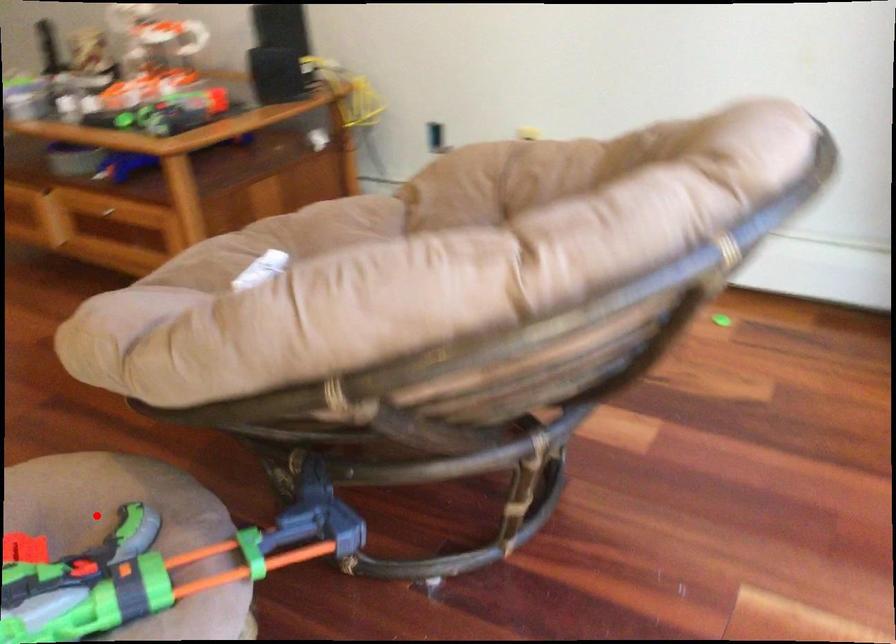
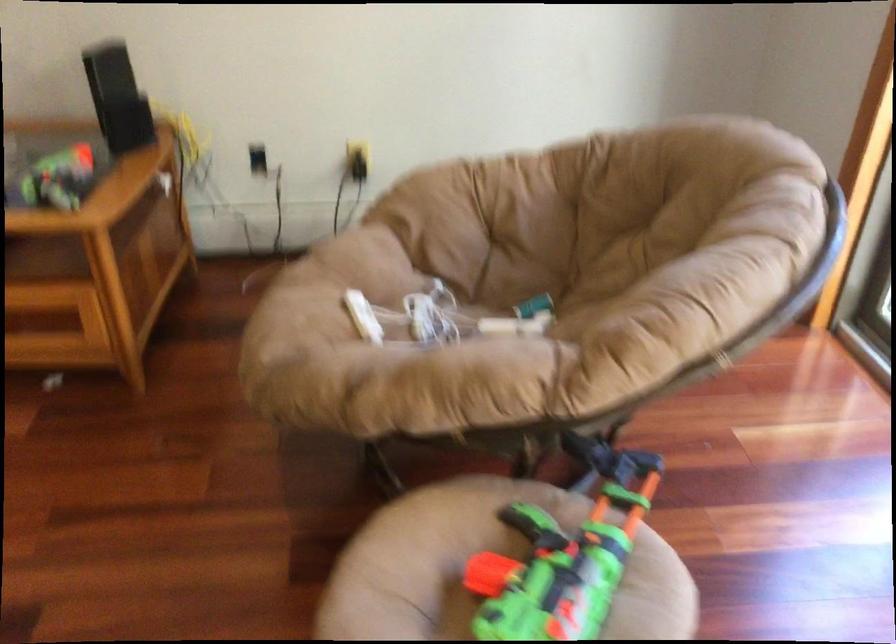
Locate, in the second image, the point that corresponds to the highlighted location in the first image.

(530, 520)